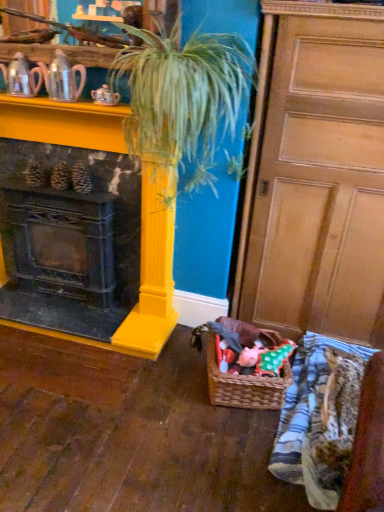
At what (x,y) coordinates should I click in order to perform the action: click on empty space that is ontop of woven brown basket at lower center (from a real-world perspective). Please return your answer as a coordinate pair (x, y). Looking at the image, I should click on (246, 348).